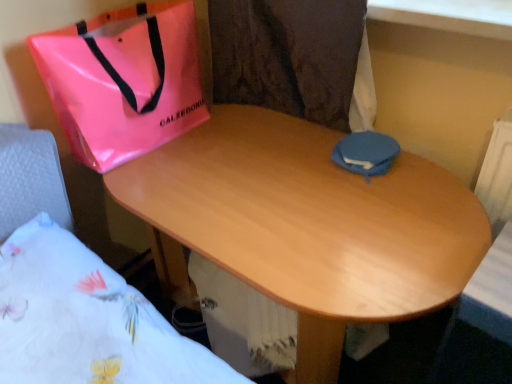
Question: From the image's perspective, is pink glossy bag at upper left located beneath blue fabric pouch at center?

Choices:
 (A) no
 (B) yes

Answer: (A)

Question: Considering the relative sizes of pink glossy bag at upper left and blue fabric pouch at center in the image provided, is pink glossy bag at upper left bigger than blue fabric pouch at center?

Choices:
 (A) no
 (B) yes

Answer: (B)

Question: Is pink glossy bag at upper left with blue fabric pouch at center?

Choices:
 (A) no
 (B) yes

Answer: (A)

Question: From a real-world perspective, is pink glossy bag at upper left beneath blue fabric pouch at center?

Choices:
 (A) yes
 (B) no

Answer: (B)

Question: Is pink glossy bag at upper left not inside blue fabric pouch at center?

Choices:
 (A) yes
 (B) no

Answer: (A)

Question: Can you confirm if pink glossy bag at upper left is positioned to the right of blue fabric pouch at center?

Choices:
 (A) yes
 (B) no

Answer: (B)

Question: From a real-world perspective, is pink glossy bag at upper left on wooden desk at center?

Choices:
 (A) yes
 (B) no

Answer: (A)

Question: Is pink glossy bag at upper left next to wooden desk at center and touching it?

Choices:
 (A) yes
 (B) no

Answer: (B)

Question: Considering the relative sizes of pink glossy bag at upper left and wooden desk at center in the image provided, is pink glossy bag at upper left thinner than wooden desk at center?

Choices:
 (A) no
 (B) yes

Answer: (B)

Question: From the image's perspective, would you say pink glossy bag at upper left is shown under wooden desk at center?

Choices:
 (A) yes
 (B) no

Answer: (B)

Question: Is pink glossy bag at upper left completely or partially outside of wooden desk at center?

Choices:
 (A) yes
 (B) no

Answer: (A)

Question: Is pink glossy bag at upper left to the left of wooden desk at center from the viewer's perspective?

Choices:
 (A) yes
 (B) no

Answer: (A)

Question: Is white floral fabric at lower left at the back of wooden desk at center?

Choices:
 (A) yes
 (B) no

Answer: (B)